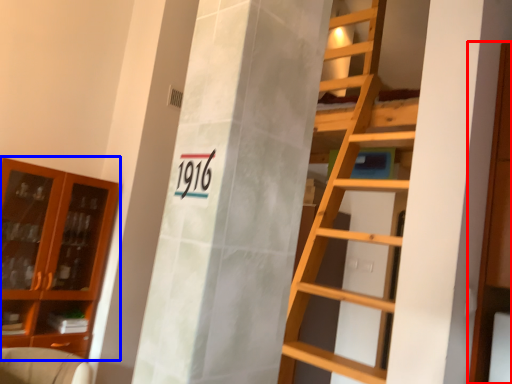
Question: Which object appears farthest to the camera in this image, cabinetry (highlighted by a red box) or cabinetry (highlighted by a blue box)?

Choices:
 (A) cabinetry
 (B) cabinetry

Answer: (B)